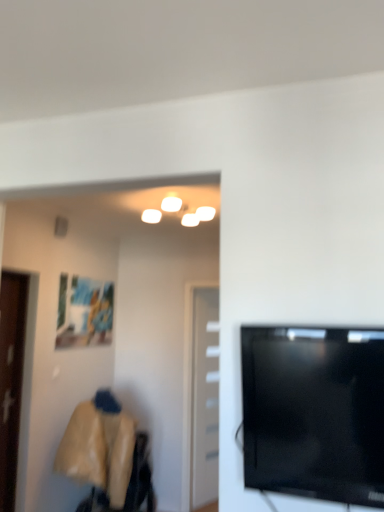
Question: Is matte plastic picture frame at upper left bigger than white glossy door at center, which is the 1th door from right to left?

Choices:
 (A) yes
 (B) no

Answer: (B)

Question: Is matte plastic picture frame at upper left aimed at white glossy door at center, arranged as the 2th door when viewed from the left?

Choices:
 (A) no
 (B) yes

Answer: (A)

Question: Is matte plastic picture frame at upper left smaller than white glossy door at center, which is the 2th door in front-to-back order?

Choices:
 (A) no
 (B) yes

Answer: (B)

Question: From a real-world perspective, is matte plastic picture frame at upper left positioned under white glossy door at center, which is counted as the first door, starting from the back, based on gravity?

Choices:
 (A) yes
 (B) no

Answer: (B)

Question: Is matte plastic picture frame at upper left at the right side of white glossy door at center, which is the 1th door from right to left?

Choices:
 (A) no
 (B) yes

Answer: (A)

Question: Relative to black glossy tv at right, is brown wooden door at left, marked as the 2th door in a right-to-left arrangement, in front or behind?

Choices:
 (A) front
 (B) behind

Answer: (B)

Question: Considering the positions of brown wooden door at left, marked as the 2th door in a right-to-left arrangement, and black glossy tv at right in the image, is brown wooden door at left, marked as the 2th door in a right-to-left arrangement, wider or thinner than black glossy tv at right?

Choices:
 (A) thin
 (B) wide

Answer: (A)

Question: Considering the positions of point (6, 298) and point (314, 376), is point (6, 298) closer or farther from the camera than point (314, 376)?

Choices:
 (A) farther
 (B) closer

Answer: (A)

Question: Considering the positions of brown wooden door at left, positioned as the 2th door in back-to-front order, and black glossy tv at right in the image, is brown wooden door at left, positioned as the 2th door in back-to-front order, bigger or smaller than black glossy tv at right?

Choices:
 (A) big
 (B) small

Answer: (A)

Question: Is matte plastic picture frame at upper left inside or outside of black glossy tv at right?

Choices:
 (A) inside
 (B) outside

Answer: (B)

Question: Relative to black glossy tv at right, is matte plastic picture frame at upper left in front or behind?

Choices:
 (A) front
 (B) behind

Answer: (B)

Question: From the image's perspective, is matte plastic picture frame at upper left positioned above or below black glossy tv at right?

Choices:
 (A) above
 (B) below

Answer: (B)

Question: Visually, is matte plastic picture frame at upper left positioned to the left or to the right of black glossy tv at right?

Choices:
 (A) right
 (B) left

Answer: (B)

Question: Relative to white glossy door at center, which is the 1th door from right to left, is black glossy tv at right in front or behind?

Choices:
 (A) behind
 (B) front

Answer: (B)

Question: Choose the correct answer: Is black glossy tv at right inside white glossy door at center, arranged as the 2th door when viewed from the left, or outside it?

Choices:
 (A) outside
 (B) inside

Answer: (A)